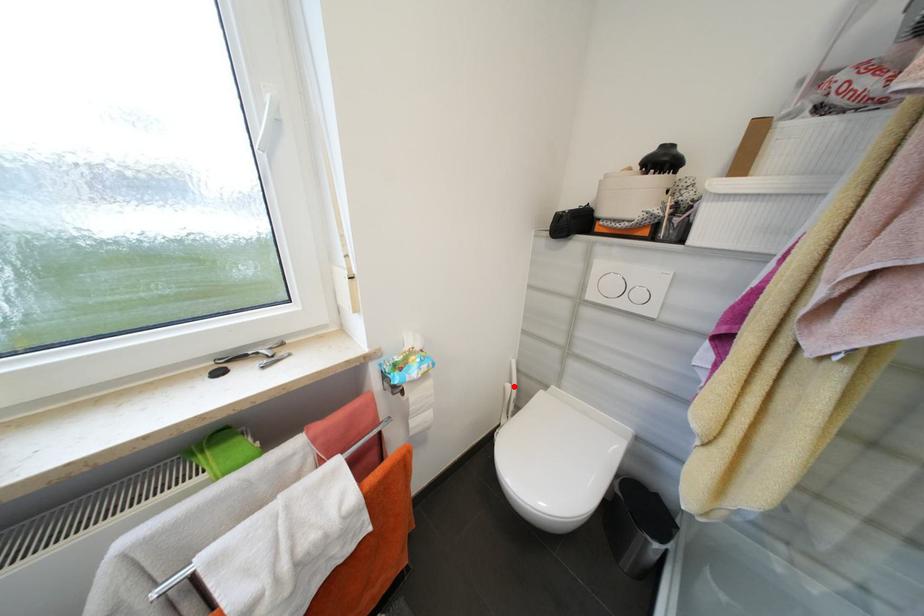
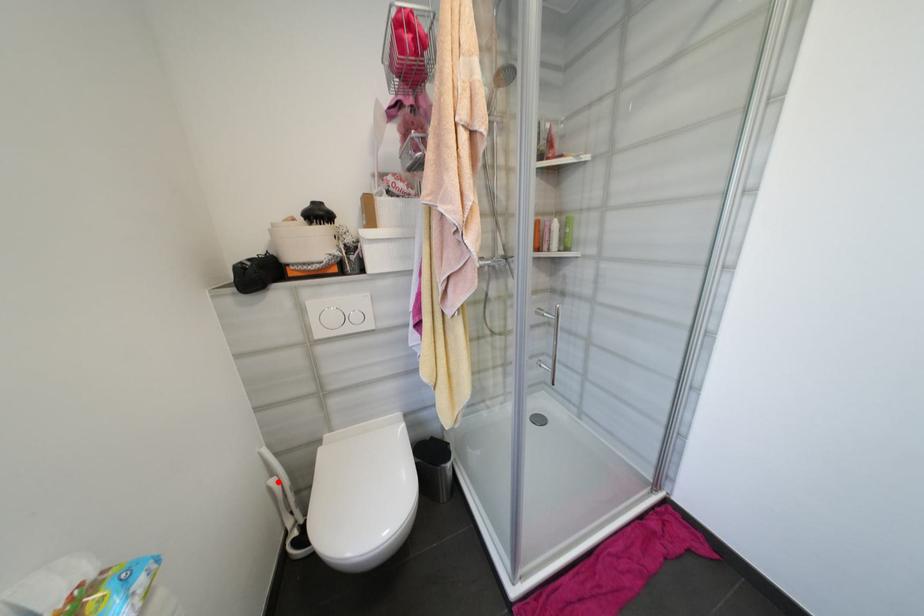
I am providing you with two images of the same scene from different viewpoints. A red point is marked on the first image and another point is marked on the second image. Does the point marked in image1 correspond to the same location as the one in image2?

Yes